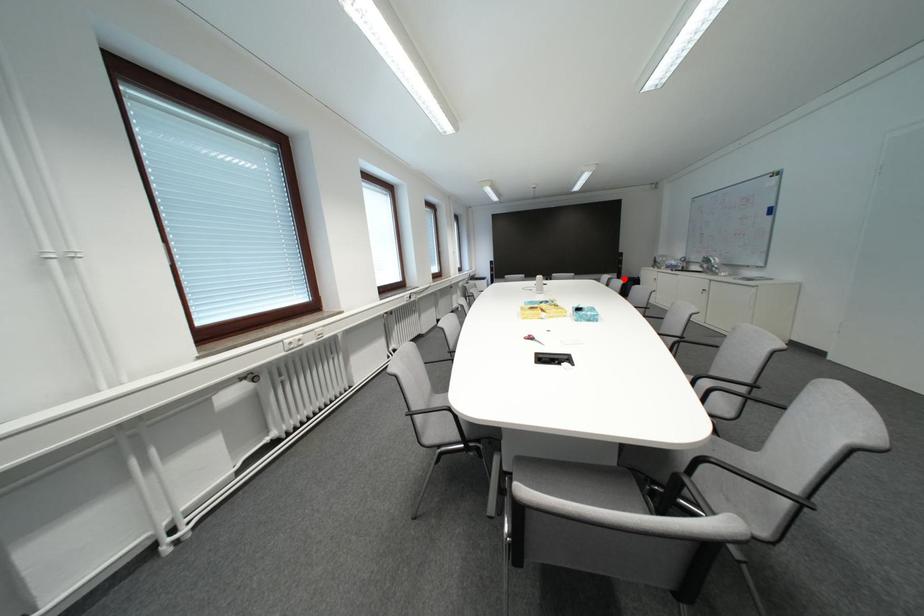
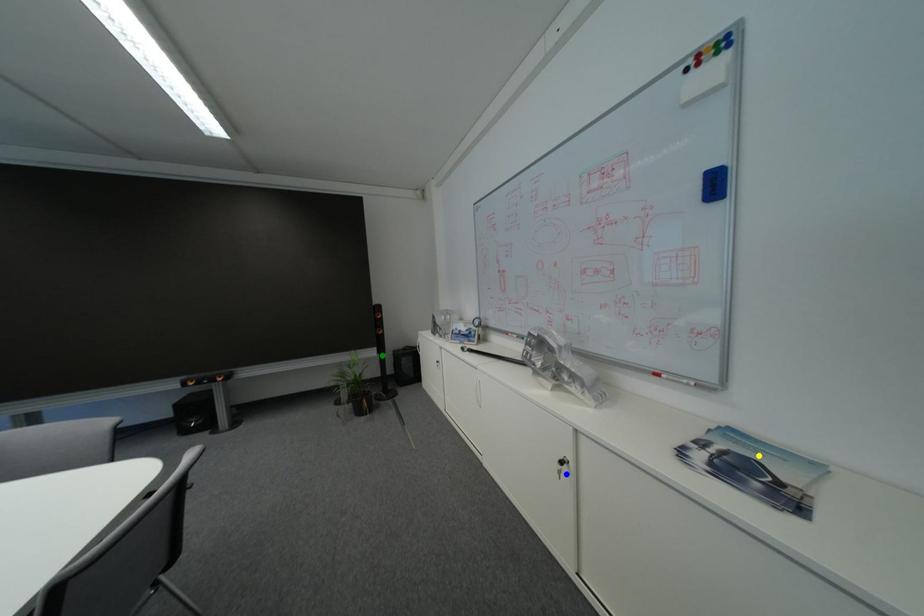
Question: I am providing you with two images of the same scene from different viewpoints. A red point is marked on the first image. You are given multiple points on the second image. Which mark in image 2 goes with the point in image 1?

Choices:
 (A) blue point
 (B) yellow point
 (C) green point

Answer: (C)